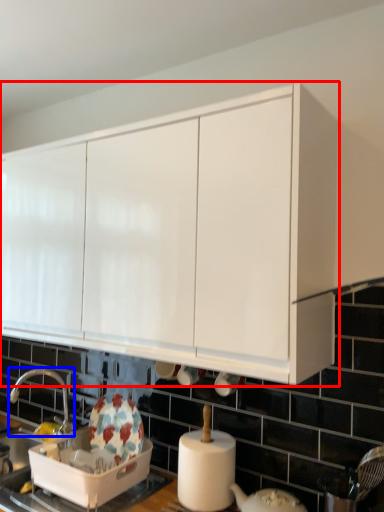
Question: Which point is further to the camera, cabinetry (highlighted by a red box) or tap (highlighted by a blue box)?

Choices:
 (A) cabinetry
 (B) tap

Answer: (B)